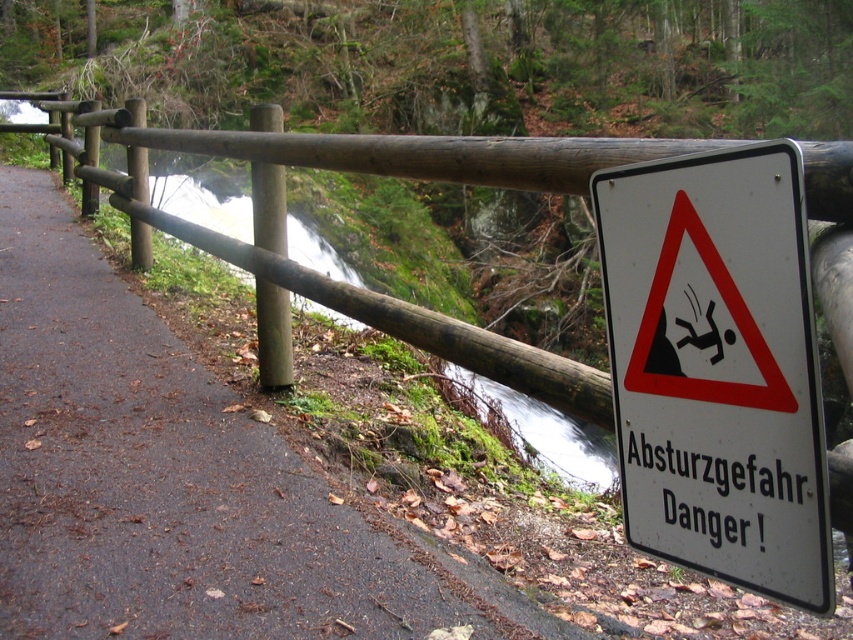
Question: Does white plastic sign at right have a lesser width compared to green mossy creek at left?

Choices:
 (A) no
 (B) yes

Answer: (B)

Question: Which point is farther to the camera?

Choices:
 (A) (729, 161)
 (B) (583, 426)

Answer: (B)

Question: From the image, what is the correct spatial relationship of white plastic sign at right in relation to green mossy creek at left?

Choices:
 (A) left
 (B) right

Answer: (B)

Question: Is white plastic sign at right bigger than green mossy creek at left?

Choices:
 (A) no
 (B) yes

Answer: (A)

Question: Which point is closer to the camera taking this photo?

Choices:
 (A) (709, 352)
 (B) (543, 413)

Answer: (A)